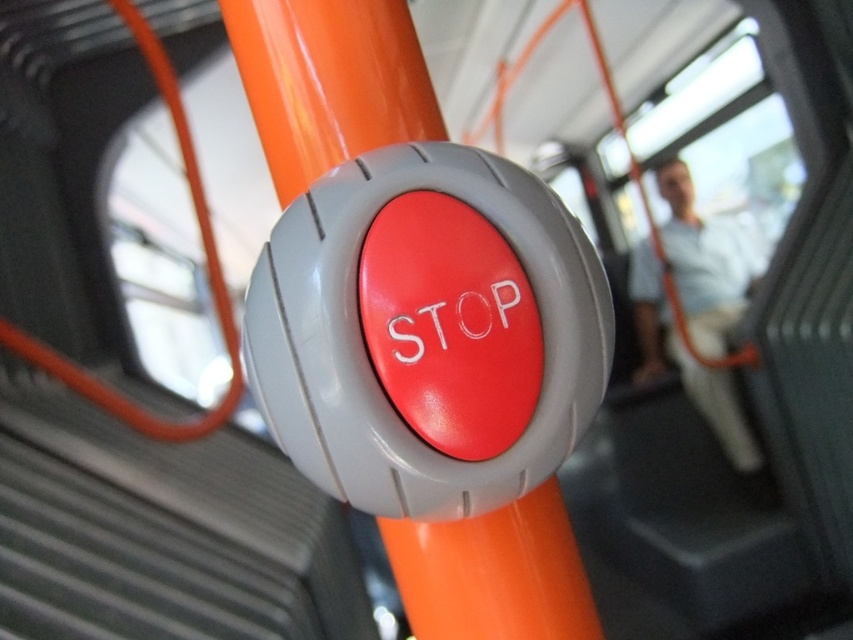
Does point (437, 128) come closer to viewer compared to point (750, 470)?

Yes, point (437, 128) is in front of point (750, 470).

Does matte orange pole at center have a smaller size compared to white fabric coach at upper center?

Indeed, matte orange pole at center has a smaller size compared to white fabric coach at upper center.

This screenshot has height=640, width=853. Find the location of `matte orange pole at center`. matte orange pole at center is located at coordinates (329, 81).